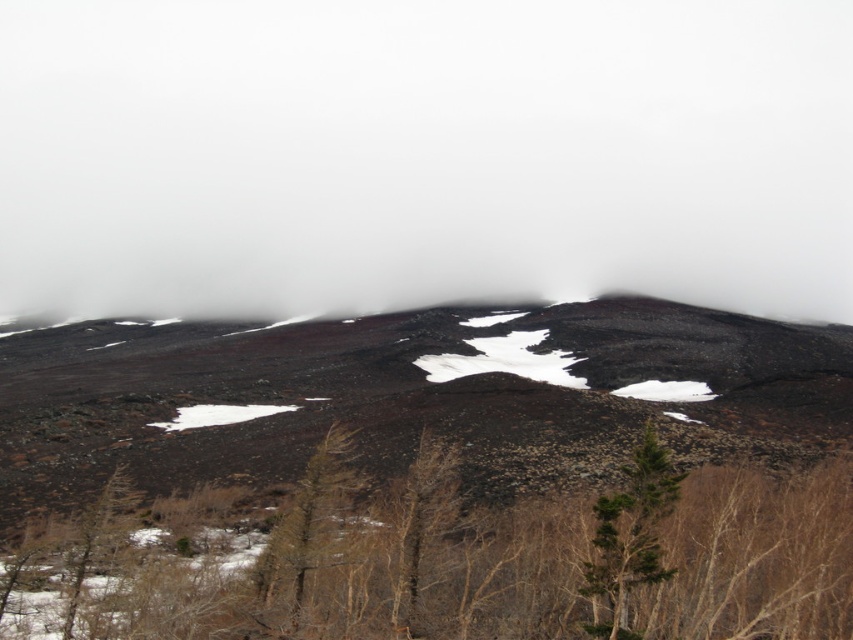
You are an explorer in this barren landscape. You see a green leafy tree at center and a brown matte tree at lower center. Which tree is nearer to you?

The green leafy tree at center is closer to the viewer than the brown matte tree at lower center.

You are planning to plant a new tree in this barren landscape. The green leafy tree at center and the brown matte tree at lower center are already present. According to the spacing guidelines, trees should be at least 30 feet apart to ensure proper growth. Based on their current distance, is the spacing between them sufficient?

The green leafy tree at center and brown matte tree at lower center are 29.49 feet apart, which is just below the recommended 30 feet. Therefore, the spacing between them is insufficient to meet the guidelines.

You are a photographer standing at the edge of this volcanic terrain. You want to capture both the point at coordinates point (51, 282) and the point at coordinates point (407, 333) in the same frame. Which point should you focus on first to ensure both are in focus?

You should focus on point (51, 282) first because it is closer to the camera than point (407, 333). By focusing on the closer point, the farther point will also be within the depth of field, ensuring both are in focus.